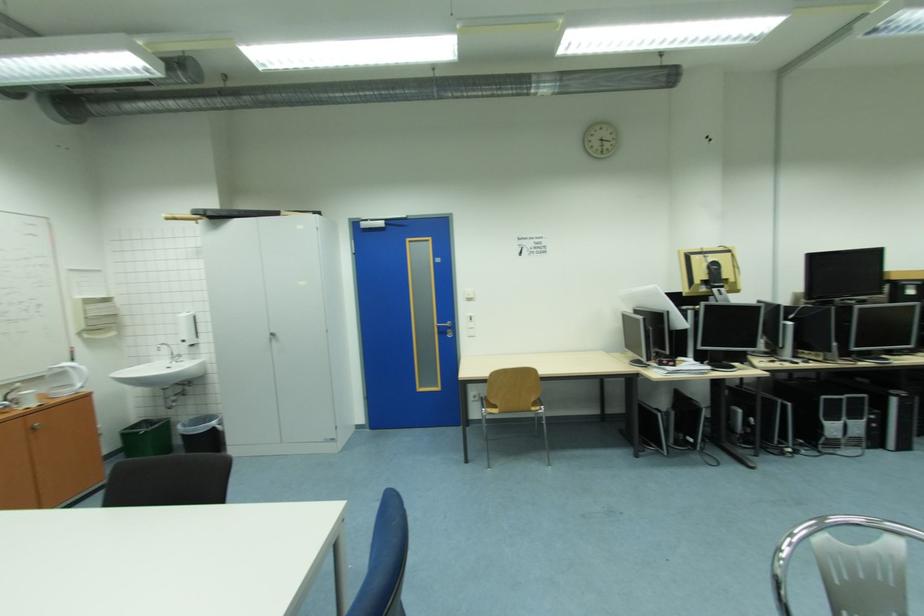
What do you see at coordinates (166, 350) in the screenshot? I see `the faucet handle` at bounding box center [166, 350].